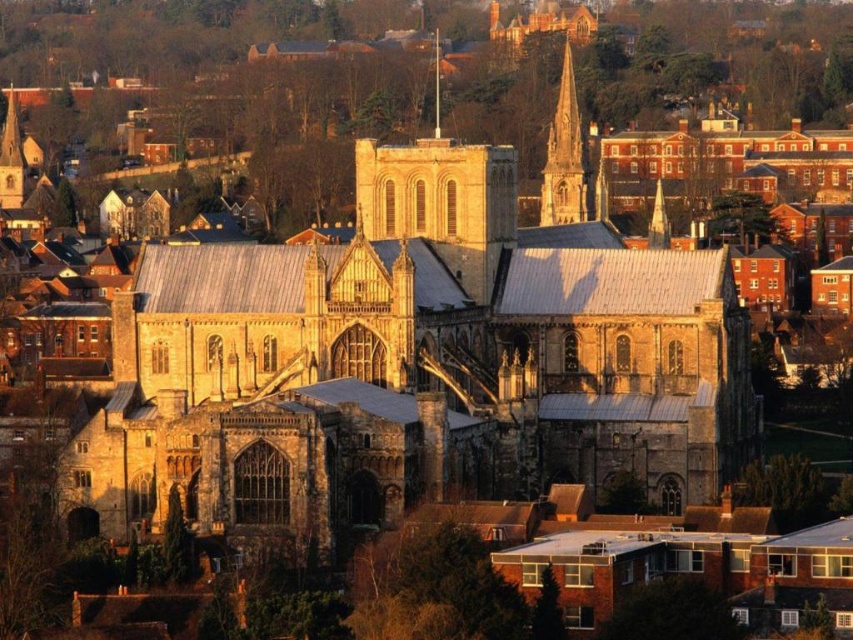
You are standing in the town square looking at the cathedral. Which object is positioned higher up in the image, the stone church at center or the smooth stone spire at upper center?

The smooth stone spire at upper center is positioned higher up in the image than the stone church at center.